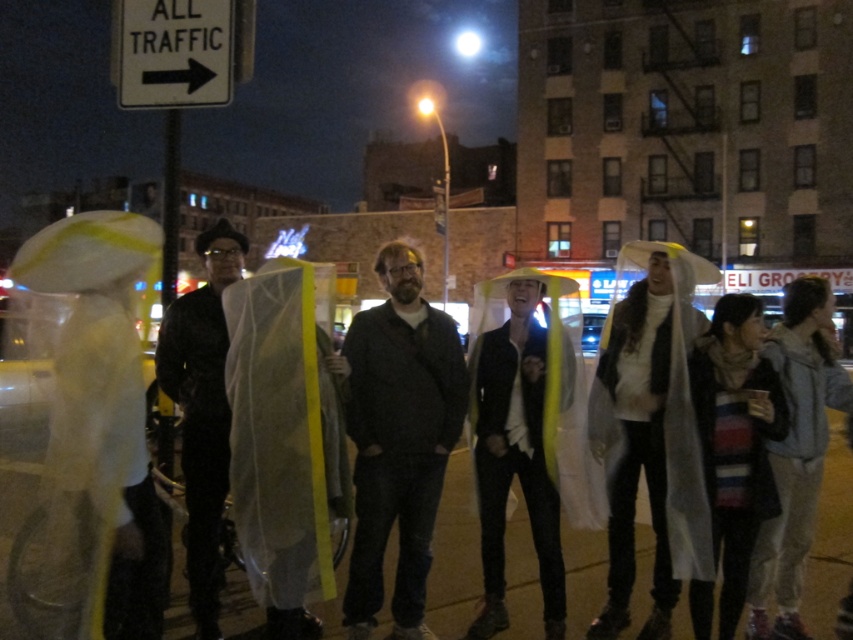
Question: Which point is farther to the camera?

Choices:
 (A) (538, 429)
 (B) (148, 40)
 (C) (225, 220)
 (D) (389, 502)

Answer: (C)

Question: Estimate the real-world distances between objects in this image. Which object is closer to the dark gray cotton jacket at center?

Choices:
 (A) black matte coat at center
 (B) translucent yellow raincoat at center
 (C) white plastic sign at upper left

Answer: (B)

Question: Is dark gray cotton jacket at center above translucent yellow raincoat at center?

Choices:
 (A) yes
 (B) no

Answer: (A)

Question: Can you confirm if dark gray cotton jacket at center is wider than white plastic sign at upper left?

Choices:
 (A) no
 (B) yes

Answer: (A)

Question: Among these points, which one is farthest from the camera?

Choices:
 (A) (222, 484)
 (B) (553, 560)

Answer: (B)

Question: Does dark gray cotton jacket at center come behind white plastic sign at upper left?

Choices:
 (A) no
 (B) yes

Answer: (A)